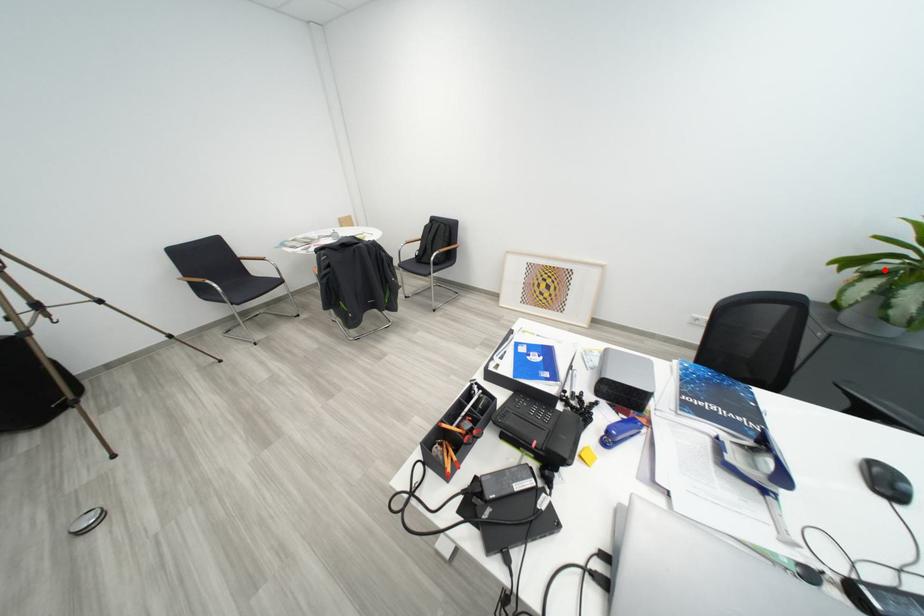
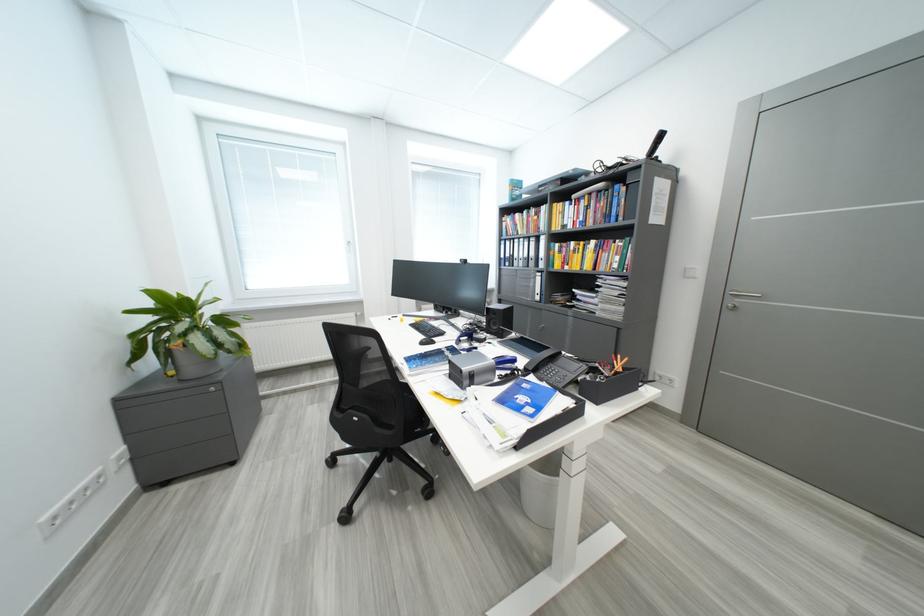
Question: I am providing you with two images of the same scene from different viewpoints. A red point is shown in image1. For the corresponding object point in image2, is it positioned nearer or farther from the camera?

Choices:
 (A) Nearer
 (B) Farther

Answer: (A)